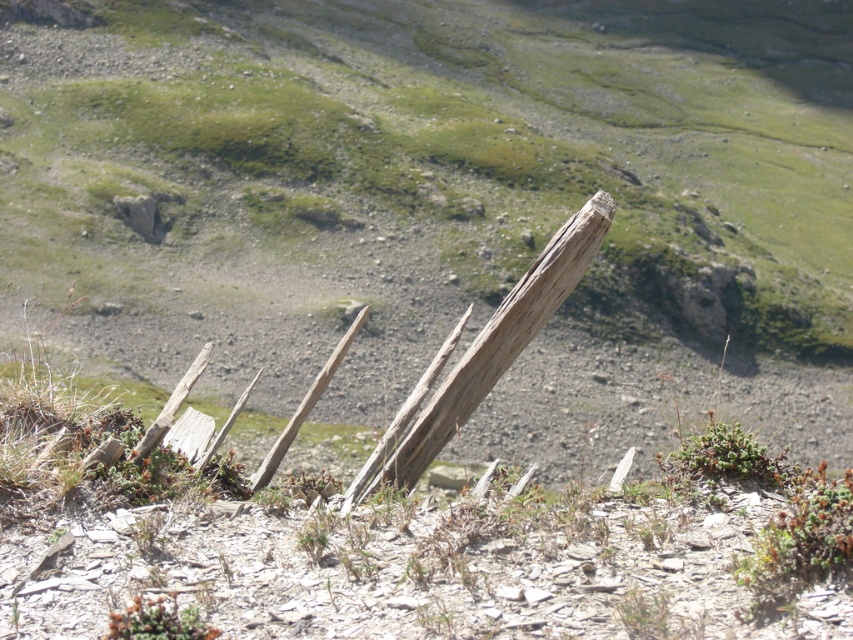
Who is more distant from viewer, (691, 468) or (167, 624)?

Positioned behind is point (691, 468).

How far apart are green leafy plant at lower right and green leafy plant at lower left?

A distance of 2.80 meters exists between green leafy plant at lower right and green leafy plant at lower left.

This screenshot has width=853, height=640. Find the location of `green leafy plant at lower right`. green leafy plant at lower right is located at coordinates (729, 456).